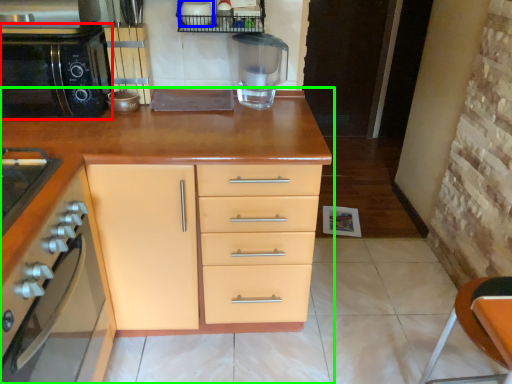
Question: Considering the real-world distances, which object is farthest from home appliance (highlighted by a red box)? appliance (highlighted by a blue box) or cabinetry (highlighted by a green box)?

Choices:
 (A) appliance
 (B) cabinetry

Answer: (A)